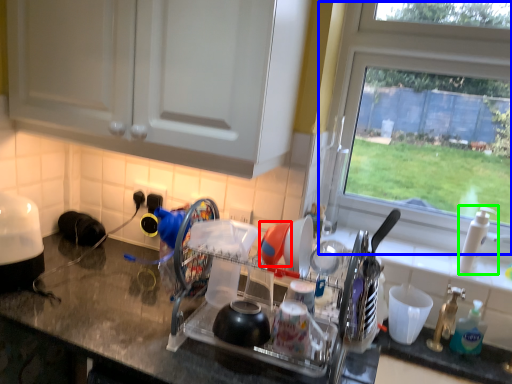
Question: Which is nearer to the tableware (highlighted by a red box)? window (highlighted by a blue box) or faucet (highlighted by a green box).

Choices:
 (A) window
 (B) faucet

Answer: (B)